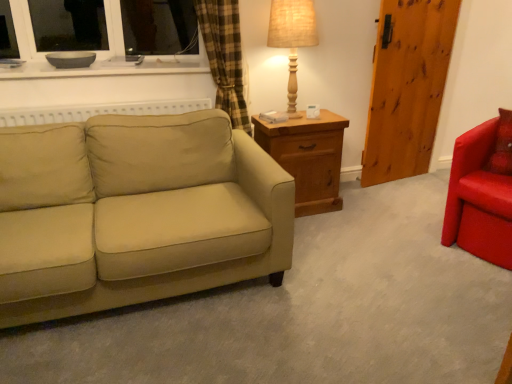
Question: Does point (288, 74) appear closer or farther from the camera than point (196, 281)?

Choices:
 (A) closer
 (B) farther

Answer: (B)

Question: From a real-world perspective, is burlap fabric table lamp at upper right positioned above or below beige fabric couch at left?

Choices:
 (A) below
 (B) above

Answer: (B)

Question: Estimate the real-world distances between objects in this image. Which object is farther from the beige fabric couch at left?

Choices:
 (A) wooden nightstand at center
 (B) white glossy bowl at upper left
 (C) burlap fabric table lamp at upper right
 (D) shiny red armchair at right
 (E) wooden barn door at right

Answer: (E)

Question: Which of these objects is positioned closest to the shiny red armchair at right?

Choices:
 (A) burlap fabric table lamp at upper right
 (B) wooden barn door at right
 (C) wooden nightstand at center
 (D) white glossy bowl at upper left
 (E) beige fabric couch at left

Answer: (C)